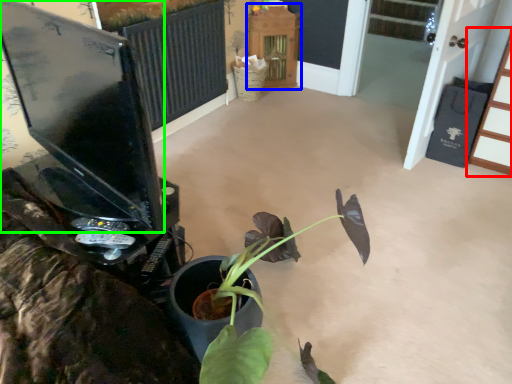
Question: Estimate the real-world distances between objects in this image. Which object is farther from furniture (highlighted by a red box), furniture (highlighted by a blue box) or computer monitor (highlighted by a green box)?

Choices:
 (A) furniture
 (B) computer monitor

Answer: (B)